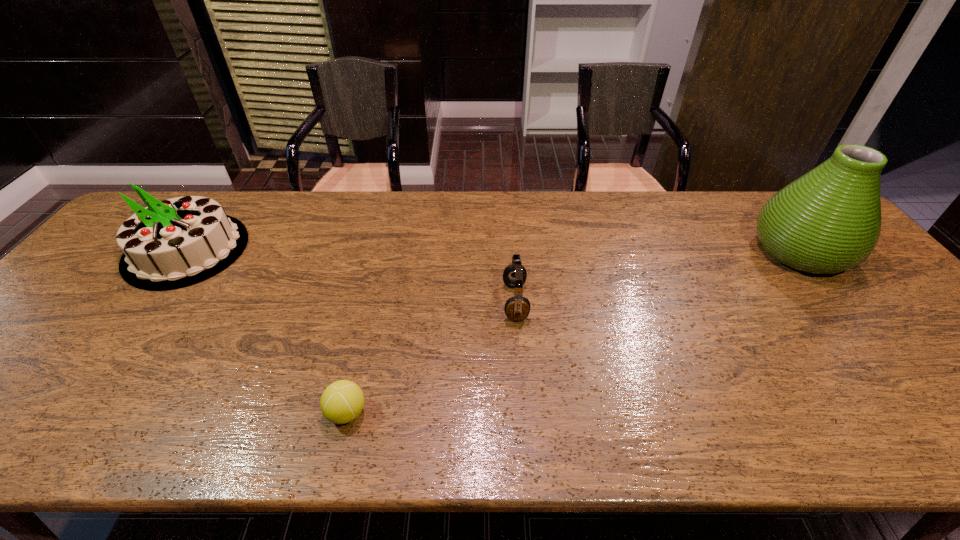
Where is `vacant space situated 0.150m on the ear cups of the headset`? vacant space situated 0.150m on the ear cups of the headset is located at coordinates (444, 302).

The image size is (960, 540). I want to click on free space located 0.350m on the ear cups of the headset, so click(367, 302).

Identify the location of free space located 0.190m on the ear cups of the headset. (429, 302).

Locate an element on the screen. This screenshot has width=960, height=540. vacant space situated on the back of the tennis ball is located at coordinates [379, 278].

Find the location of a particular element. This screenshot has height=540, width=960. vase that is positioned at the far edge is located at coordinates (827, 221).

Identify the location of birthday cake that is at the far edge. (175, 243).

Where is `object that is at the near edge`? This screenshot has width=960, height=540. object that is at the near edge is located at coordinates (341, 402).

Image resolution: width=960 pixels, height=540 pixels. I want to click on object that is at the left edge, so click(x=175, y=243).

Find the location of a particular element. object that is at the right edge is located at coordinates (827, 221).

I want to click on object that is positioned at the far left corner, so click(175, 243).